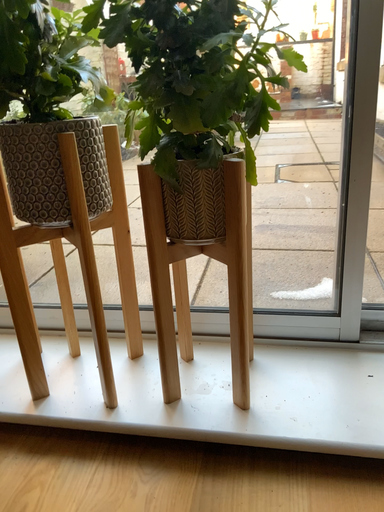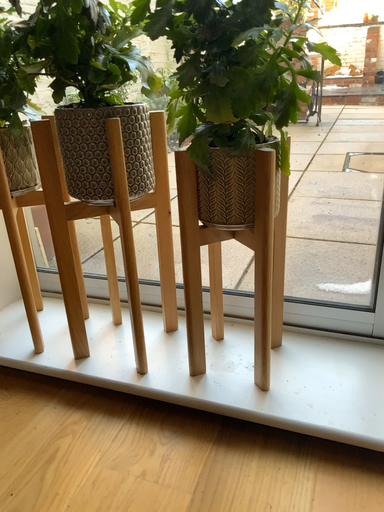
Question: Which way did the camera rotate in the video?

Choices:
 (A) rotated left
 (B) rotated right

Answer: (A)